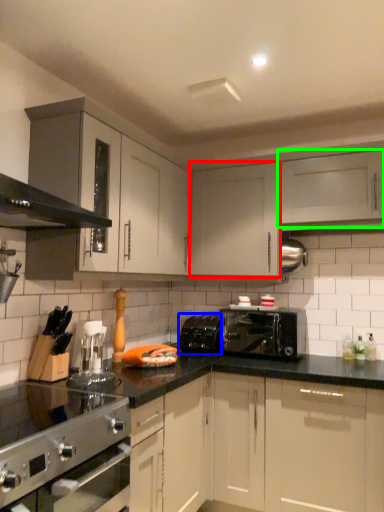
Question: Considering the real-world distances, which object is closest to cabinetry (highlighted by a red box)? appliance (highlighted by a blue box) or cabinetry (highlighted by a green box).

Choices:
 (A) appliance
 (B) cabinetry

Answer: (B)